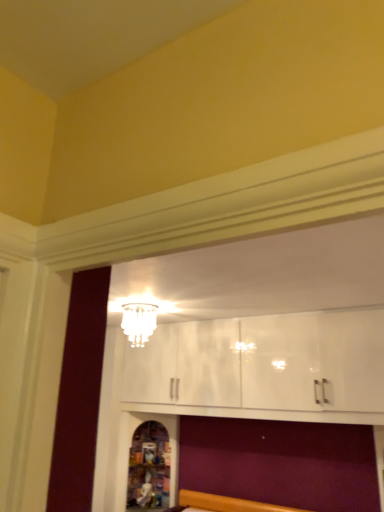
I want to click on wooden carved statue at lower center, so click(131, 443).

What do you see at coordinates (131, 443) in the screenshot? I see `wooden carved statue at lower center` at bounding box center [131, 443].

Find the location of a particular element. white glass chandelier at upper center is located at coordinates (139, 322).

What is the approximate width of white glass chandelier at upper center?

9.89 inches.

What do you see at coordinates (139, 322) in the screenshot?
I see `white glass chandelier at upper center` at bounding box center [139, 322].

Where is `wooden carved statue at lower center`? wooden carved statue at lower center is located at coordinates (131, 443).

Is white glass chandelier at upper center to the left of wooden carved statue at lower center from the viewer's perspective?

No.

Does white glass chandelier at upper center come in front of wooden carved statue at lower center?

Yes, white glass chandelier at upper center is in front of wooden carved statue at lower center.

Which point is more forward, (x=133, y=324) or (x=174, y=500)?

The point (x=133, y=324) is closer to the camera.

From the image's perspective, is white glass chandelier at upper center located above wooden carved statue at lower center?

Yes.

From a real-world perspective, is white glass chandelier at upper center positioned under wooden carved statue at lower center based on gravity?

No.

Between white glass chandelier at upper center and wooden carved statue at lower center, which one has smaller width?

white glass chandelier at upper center is thinner.

From their relative heights in the image, would you say white glass chandelier at upper center is taller or shorter than wooden carved statue at lower center?

Clearly, white glass chandelier at upper center is shorter compared to wooden carved statue at lower center.

Between white glass chandelier at upper center and wooden carved statue at lower center, which one has larger size?

wooden carved statue at lower center is bigger.

Is white glass chandelier at upper center inside the boundaries of wooden carved statue at lower center, or outside?

white glass chandelier at upper center is spatially situated outside wooden carved statue at lower center.

Is white glass chandelier at upper center placed right next to wooden carved statue at lower center?

white glass chandelier at upper center and wooden carved statue at lower center are not in contact.

Is white glass chandelier at upper center facing away from wooden carved statue at lower center?

No, white glass chandelier at upper center is not facing the opposite direction of wooden carved statue at lower center.

Find the location of a particular element. Image resolution: width=384 pixels, height=512 pixels. shelf behind the white glass chandelier at upper center is located at coordinates pyautogui.click(x=131, y=443).

Based on the photo, does wooden carved statue at lower center appear on the left side of white glass chandelier at upper center?

Yes.

Which object is closer to the camera, wooden carved statue at lower center or white glass chandelier at upper center?

white glass chandelier at upper center is in front.

Considering the points (174, 502) and (133, 324), which point is in front, point (174, 502) or point (133, 324)?

Point (133, 324)

From the image's perspective, would you say wooden carved statue at lower center is positioned over white glass chandelier at upper center?

Actually, wooden carved statue at lower center appears below white glass chandelier at upper center in the image.

From a real-world perspective, which object stands above the other?

From a 3D spatial view, white glass chandelier at upper center is above.

Considering the sizes of wooden carved statue at lower center and white glass chandelier at upper center in the image, is wooden carved statue at lower center wider or thinner than white glass chandelier at upper center?

wooden carved statue at lower center is wider than white glass chandelier at upper center.

Considering the relative sizes of wooden carved statue at lower center and white glass chandelier at upper center in the image provided, is wooden carved statue at lower center taller than white glass chandelier at upper center?

Yes.

Can you confirm if wooden carved statue at lower center is smaller than white glass chandelier at upper center?

No, wooden carved statue at lower center is not smaller than white glass chandelier at upper center.

Is wooden carved statue at lower center located outside white glass chandelier at upper center?

wooden carved statue at lower center lies outside white glass chandelier at upper center's area.

Is there a large distance between wooden carved statue at lower center and white glass chandelier at upper center?

wooden carved statue at lower center is positioned a significant distance from white glass chandelier at upper center.

Looking at this image, could you tell me if wooden carved statue at lower center is facing white glass chandelier at upper center?

No, wooden carved statue at lower center is not oriented towards white glass chandelier at upper center.

How many degrees apart are the facing directions of wooden carved statue at lower center and white glass chandelier at upper center?

0.608 degrees.

The height and width of the screenshot is (512, 384). I want to click on shelf on the left of white glass chandelier at upper center, so click(x=131, y=443).

This screenshot has height=512, width=384. In order to click on light fixture on the right side of wooden carved statue at lower center in this screenshot , I will do `click(139, 322)`.

The image size is (384, 512). I want to click on light fixture positioned vertically above the wooden carved statue at lower center (from a real-world perspective), so click(139, 322).